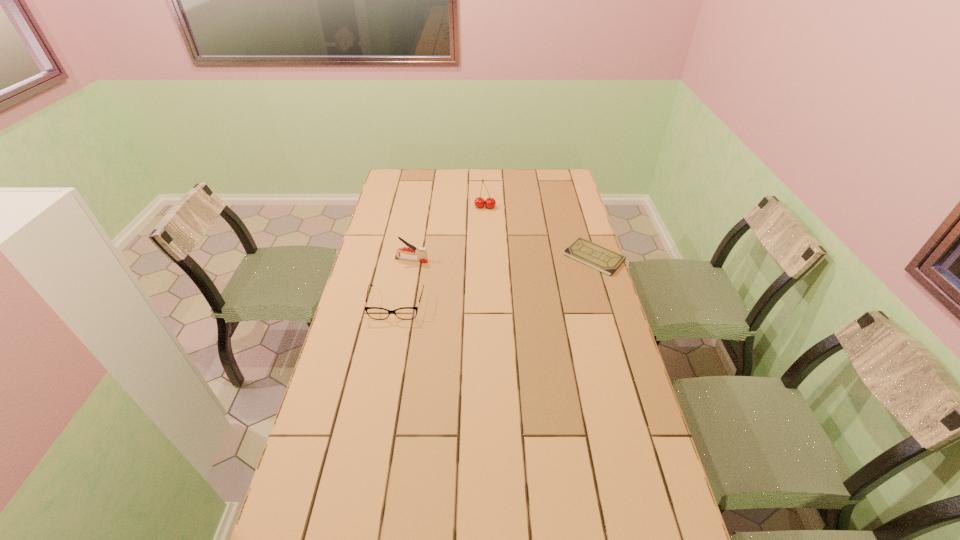
The image size is (960, 540). What are the coordinates of `the nearest object` in the screenshot? It's located at (405, 313).

Identify the location of the second shortest object. (405, 313).

The width and height of the screenshot is (960, 540). I want to click on the rightmost object, so click(591, 254).

This screenshot has height=540, width=960. In order to click on the shortest object in this screenshot , I will do [591, 254].

You are a GUI agent. You are given a task and a screenshot of the screen. Output one action in this format:
    pyautogui.click(x=<x>, y=<y>)
    Task: Click on the third shortest object
    The height and width of the screenshot is (540, 960).
    Given the screenshot: What is the action you would take?
    pyautogui.click(x=421, y=252)

You are a GUI agent. You are given a task and a screenshot of the screen. Output one action in this format:
    pyautogui.click(x=<x>, y=<y>)
    Task: Click on the cherry
    This screenshot has height=540, width=960.
    Given the screenshot: What is the action you would take?
    click(x=479, y=202)

Locate an element on the screen. This screenshot has width=960, height=540. the farthest object is located at coordinates (479, 202).

The width and height of the screenshot is (960, 540). Identify the location of vacant space located on the front-facing side of the second shortest object. (391, 331).

The image size is (960, 540). I want to click on blank space located on the left of the checkbook, so click(x=469, y=257).

Identify the location of free location located on the handle side of the second tallest object. (474, 267).